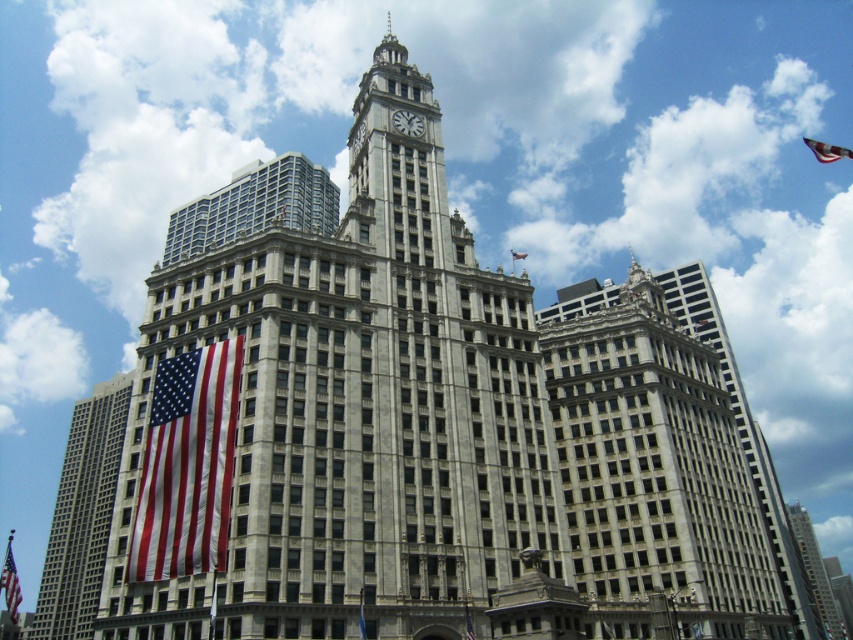
Who is positioned more to the right, american flag at left or gray stone skyscraper at center?

From the viewer's perspective, gray stone skyscraper at center appears more on the right side.

Which is behind, point (100, 464) or point (820, 582)?

Positioned behind is point (820, 582).

Is point (108, 506) farther from camera compared to point (836, 612)?

That is False.

You are a GUI agent. You are given a task and a screenshot of the screen. Output one action in this format:
    pyautogui.click(x=<x>, y=<y>)
    Task: Click on the american flag at left
    
    Given the screenshot: What is the action you would take?
    [x=82, y=515]

Does point (78, 550) lie behind point (9, 573)?

That is False.

Can you confirm if american flag at left is smaller than red fabric flag at lower left?

No, american flag at left is not smaller than red fabric flag at lower left.

Between point (103, 544) and point (9, 536), which one is positioned behind?

Point (9, 536)

Locate an element on the screen. american flag at left is located at coordinates click(82, 515).

Is american flag at center positioned behind red fabric flag at upper center?

That is False.

Consider the image. Which is above, american flag at center or red fabric flag at upper center?

red fabric flag at upper center is higher up.

Between point (469, 621) and point (517, 259), which one is positioned behind?

The point (517, 259) is behind.

This screenshot has width=853, height=640. I want to click on american flag at center, so click(x=468, y=625).